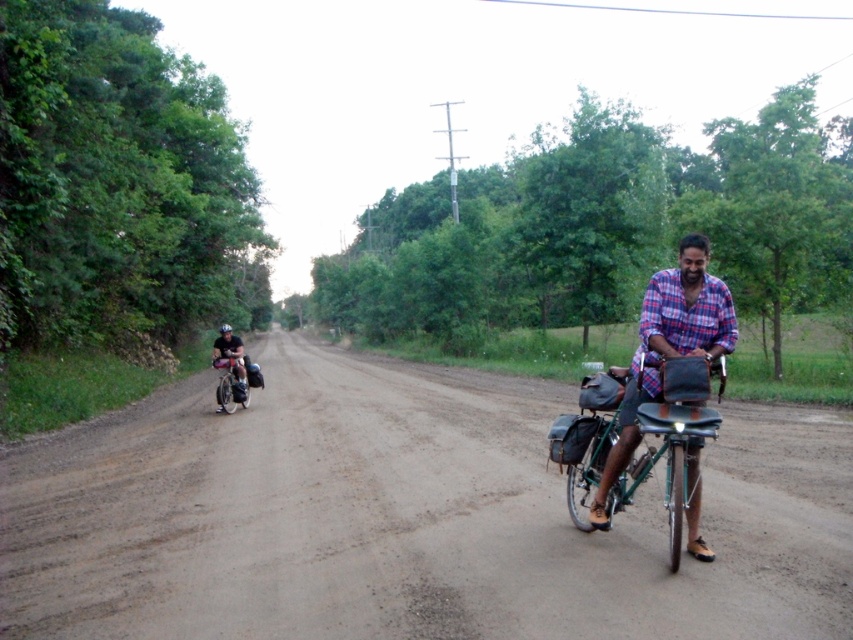
Question: Can you confirm if brown dirt track at center is thinner than dark blue fabric shirt at left?

Choices:
 (A) no
 (B) yes

Answer: (A)

Question: Which of the following is the farthest from the observer?

Choices:
 (A) (622, 524)
 (B) (572, 416)

Answer: (B)

Question: Is green metallic bicycle at right thinner than dark blue fabric shirt at left?

Choices:
 (A) no
 (B) yes

Answer: (B)

Question: Is brown dirt track at center above dark blue fabric shirt at left?

Choices:
 (A) no
 (B) yes

Answer: (A)

Question: Which point is farther from the camera taking this photo?

Choices:
 (A) (241, 346)
 (B) (744, 600)

Answer: (A)

Question: Which object appears closest to the camera in this image?

Choices:
 (A) brown dirt track at center
 (B) green metallic bicycle at right
 (C) dark blue fabric shirt at left

Answer: (A)